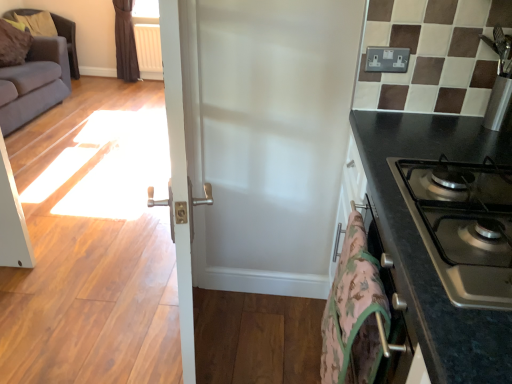
At what (x,y) coordinates should I click in order to perform the action: click on free location to the right of white glossy door at center. Please return your answer as a coordinate pair (x, y). Image resolution: width=512 pixels, height=384 pixels. Looking at the image, I should click on (251, 345).